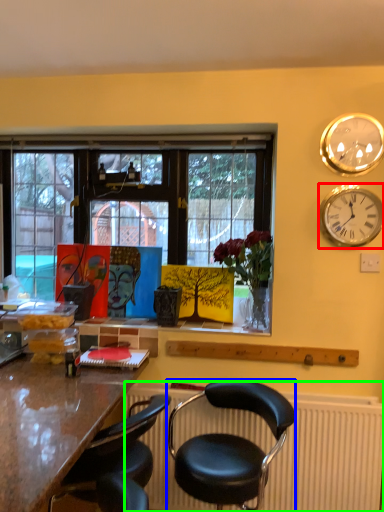
Question: Estimate the real-world distances between objects in this image. Which object is farther from wall clock (highlighted by a red box), chair (highlighted by a blue box) or radiator (highlighted by a green box)?

Choices:
 (A) chair
 (B) radiator

Answer: (A)